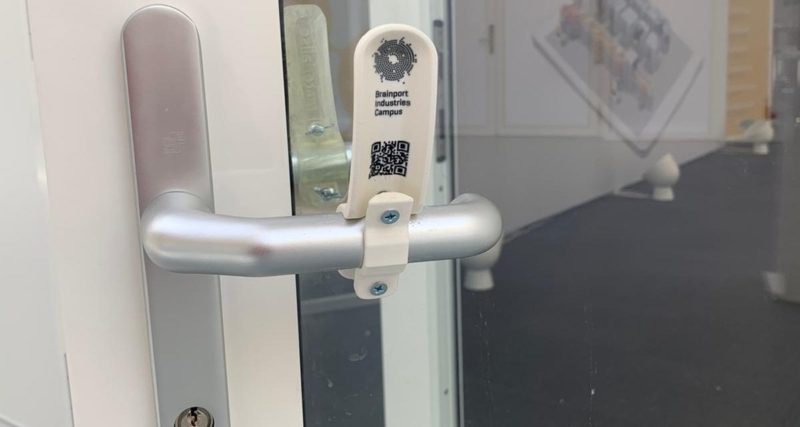
Where is `floor`? floor is located at coordinates (605, 373).